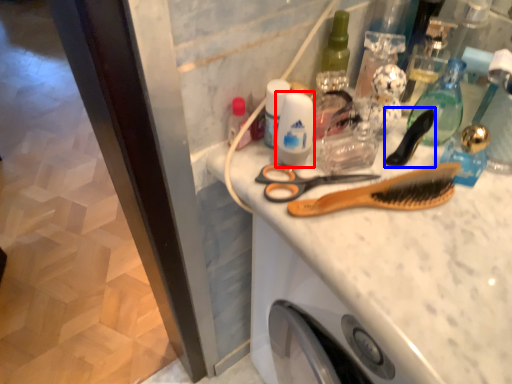
Question: Which point is further to the camera, toiletry (highlighted by a red box) or brush (highlighted by a blue box)?

Choices:
 (A) toiletry
 (B) brush

Answer: (B)